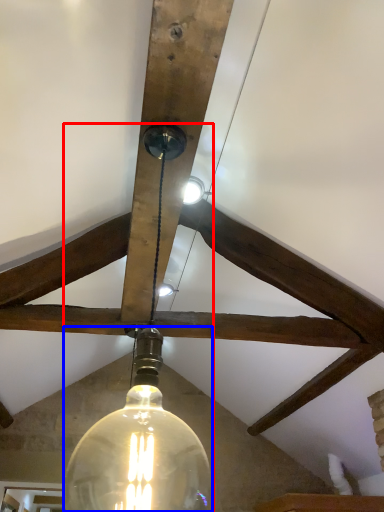
Question: Which object is closer to the camera taking this photo, lamp (highlighted by a red box) or light bulb (highlighted by a blue box)?

Choices:
 (A) lamp
 (B) light bulb

Answer: (A)